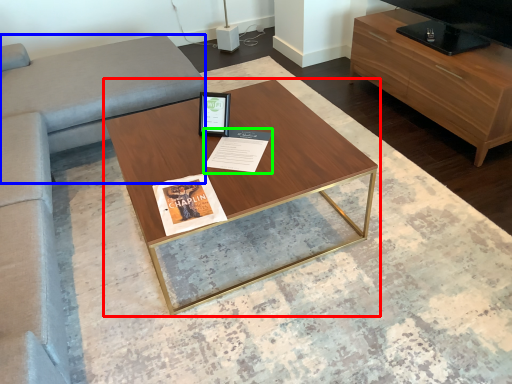
Question: Considering the real-world distances, which object is farthest from coffee table (highlighted by a red box)? gray (highlighted by a blue box) or magazine (highlighted by a green box)?

Choices:
 (A) gray
 (B) magazine

Answer: (A)